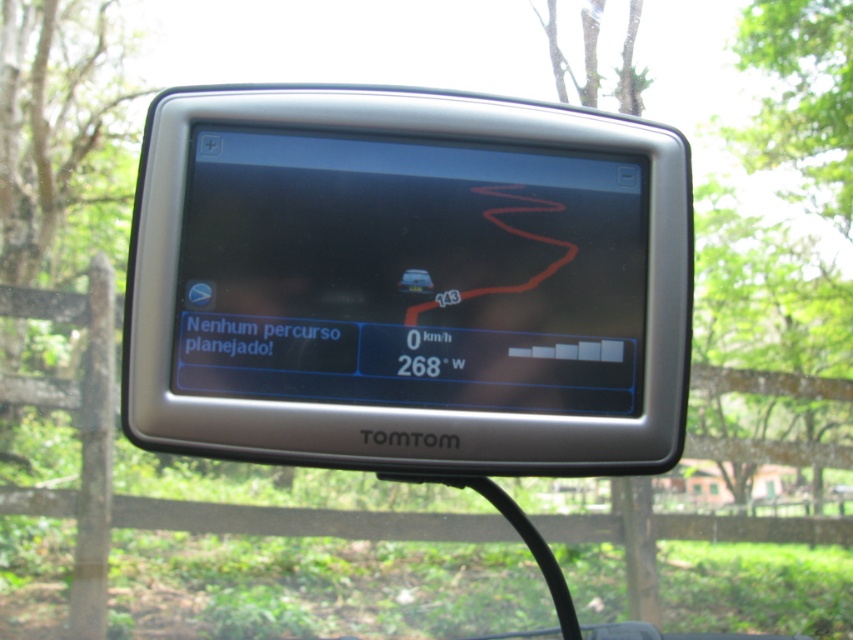
Which is above, silver plastic gps at center or matte black car at center?

Positioned higher is silver plastic gps at center.

Is silver plastic gps at center behind matte black car at center?

No, silver plastic gps at center is in front of matte black car at center.

This screenshot has width=853, height=640. What do you see at coordinates (410, 268) in the screenshot? I see `silver plastic gps at center` at bounding box center [410, 268].

Locate an element on the screen. This screenshot has width=853, height=640. silver plastic gps at center is located at coordinates (410, 268).